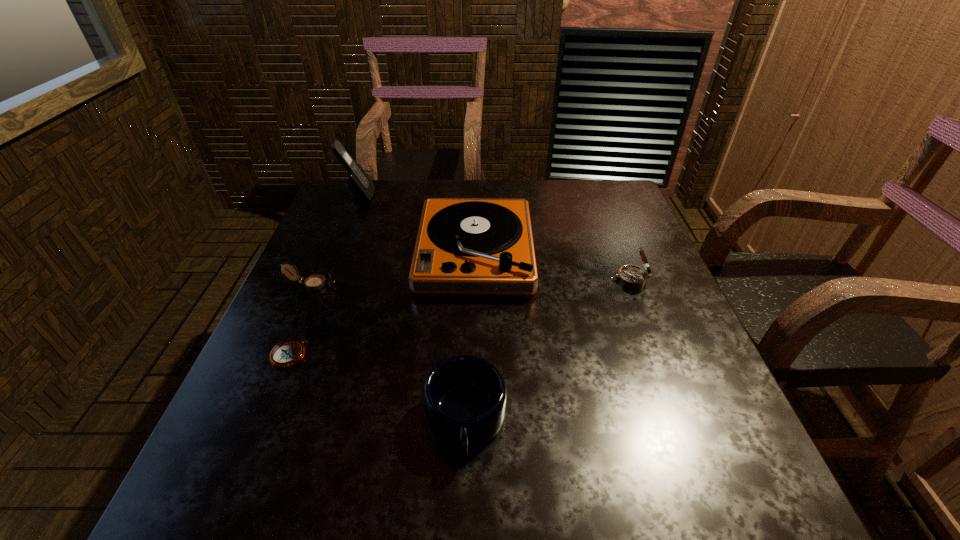
Identify the location of the tallest object. (360, 186).

Locate an element on the screen. the farthest object is located at coordinates (360, 186).

Find the location of a particular element. This screenshot has height=540, width=960. record player is located at coordinates (464, 245).

Locate an element on the screen. the rightmost object is located at coordinates (631, 276).

Locate an element on the screen. Image resolution: width=960 pixels, height=540 pixels. the tallest compass is located at coordinates (631, 276).

I want to click on mug, so click(x=465, y=396).

In order to click on the fifth tallest object in this screenshot , I will do `click(315, 282)`.

This screenshot has height=540, width=960. I want to click on the shortest compass, so click(x=287, y=353).

Identify the location of the shortest object. The width and height of the screenshot is (960, 540). (287, 353).

At what (x,y) coordinates should I click in order to perform the action: click on free space located 0.360m on the front-facing side of the tallest object. Please return your answer as a coordinate pair (x, y). Looking at the image, I should click on (491, 194).